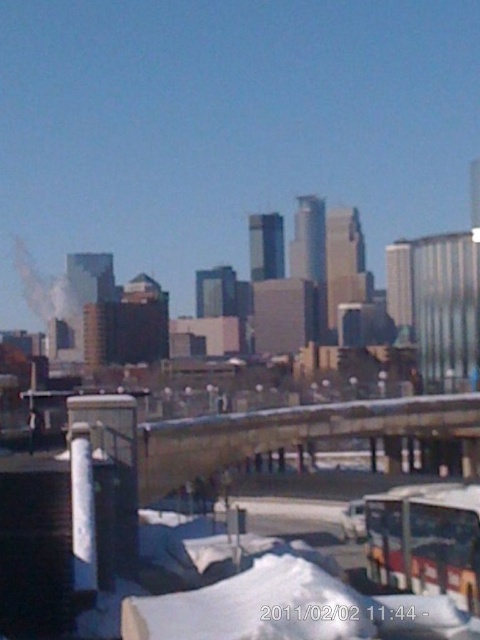
Which is above, metallic silver bus at lower right or white smoke at left?

white smoke at left is above.

Is metallic silver bus at lower right above white smoke at left?

Actually, metallic silver bus at lower right is below white smoke at left.

Is point (434, 513) positioned after point (75, 298)?

No, (434, 513) is in front of (75, 298).

This screenshot has height=640, width=480. Identify the location of metallic silver bus at lower right. (427, 540).